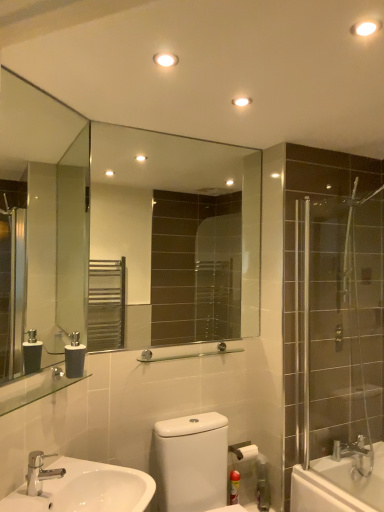
The height and width of the screenshot is (512, 384). What are the coordinates of `vacant region above clear glass mirror at center, arranged as the first mirror when viewed from the back (from a real-world perspective)` in the screenshot? It's located at (214, 136).